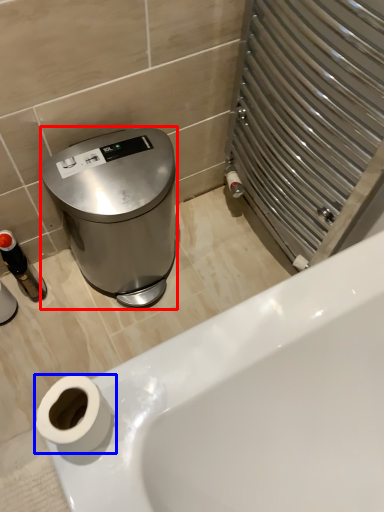
Question: Which object is further to the camera taking this photo, appliance (highlighted by a red box) or toilet paper (highlighted by a blue box)?

Choices:
 (A) appliance
 (B) toilet paper

Answer: (A)